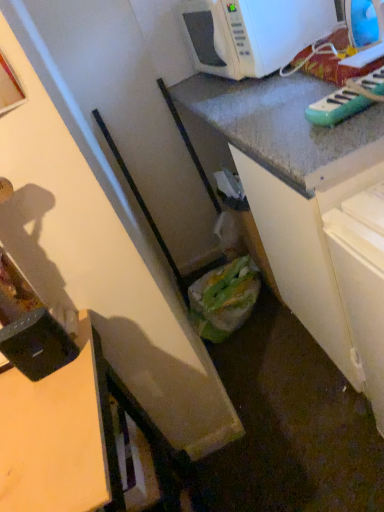
Question: Considering the relative positions of green plastic toy keyboard at upper right, acting as the first appliance starting from the top, and green plastic bag at lower center in the image provided, is green plastic toy keyboard at upper right, acting as the first appliance starting from the top, to the left of green plastic bag at lower center from the viewer's perspective?

Choices:
 (A) yes
 (B) no

Answer: (B)

Question: Is green plastic toy keyboard at upper right, the 2th appliance in the left-to-right sequence, wider than green plastic bag at lower center?

Choices:
 (A) yes
 (B) no

Answer: (A)

Question: Is green plastic toy keyboard at upper right, which is the second appliance from bottom to top, smaller than green plastic bag at lower center?

Choices:
 (A) no
 (B) yes

Answer: (B)

Question: Can you confirm if green plastic toy keyboard at upper right, the first appliance viewed from the right, is shorter than green plastic bag at lower center?

Choices:
 (A) no
 (B) yes

Answer: (B)

Question: Does green plastic toy keyboard at upper right, which is the second appliance from bottom to top, appear on the right side of green plastic bag at lower center?

Choices:
 (A) no
 (B) yes

Answer: (B)

Question: In the image, is green plastic bag at lower center on the left side or the right side of black plastic container at lower left, marked as the second appliance in a right-to-left arrangement?

Choices:
 (A) right
 (B) left

Answer: (A)

Question: From a real-world perspective, is green plastic bag at lower center positioned above or below black plastic container at lower left, which appears as the second appliance when viewed from the top?

Choices:
 (A) above
 (B) below

Answer: (B)

Question: Considering their positions, is green plastic bag at lower center located in front of or behind black plastic container at lower left, marked as the second appliance in a right-to-left arrangement?

Choices:
 (A) front
 (B) behind

Answer: (B)

Question: From the image's perspective, is green plastic bag at lower center positioned above or below black plastic container at lower left, marked as the second appliance in a right-to-left arrangement?

Choices:
 (A) below
 (B) above

Answer: (B)

Question: Do you think white glossy microwave at upper right is within wooden desk at lower left, or outside of it?

Choices:
 (A) inside
 (B) outside

Answer: (B)

Question: From the image's perspective, relative to wooden desk at lower left, is white glossy microwave at upper right above or below?

Choices:
 (A) below
 (B) above

Answer: (B)

Question: Is white glossy microwave at upper right in front of or behind wooden desk at lower left in the image?

Choices:
 (A) behind
 (B) front

Answer: (A)

Question: Is point (259, 6) closer or farther from the camera than point (44, 495)?

Choices:
 (A) farther
 (B) closer

Answer: (A)

Question: Is wooden desk at lower left inside or outside of black plastic container at lower left, acting as the 1th appliance starting from the left?

Choices:
 (A) inside
 (B) outside

Answer: (B)

Question: Is wooden desk at lower left bigger or smaller than black plastic container at lower left, marked as the second appliance in a right-to-left arrangement?

Choices:
 (A) big
 (B) small

Answer: (A)